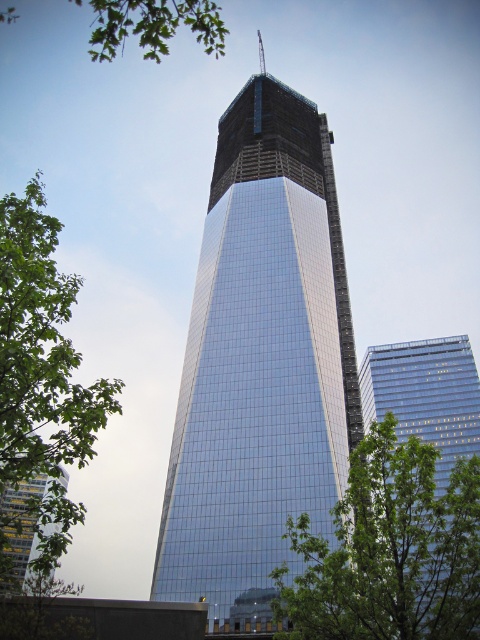
You are a construction worker standing at the base of the glassy reflective skyscraper at right. You need to place a ladder to reach a window 350 feet above the ground. Can you safely place the ladder without it exceeding the building height?

The glassy reflective skyscraper at right is 359.91 feet tall. The ladder needs to reach 350 feet, which is within the building height, so it can be safely placed.

You are an architect reviewing the construction site. You notice two points marked on the blueprint at coordinates point (336, 374) and point (350, 486). Which point is closer to the foreground of the image?

Point (350, 486) is closer to the foreground because it is in front of point (336, 374).

You are standing at the point marked as point (260, 362). What object is directly in front of you?

The glossy glass skyscraper at center is directly in front of you at point (260, 362).